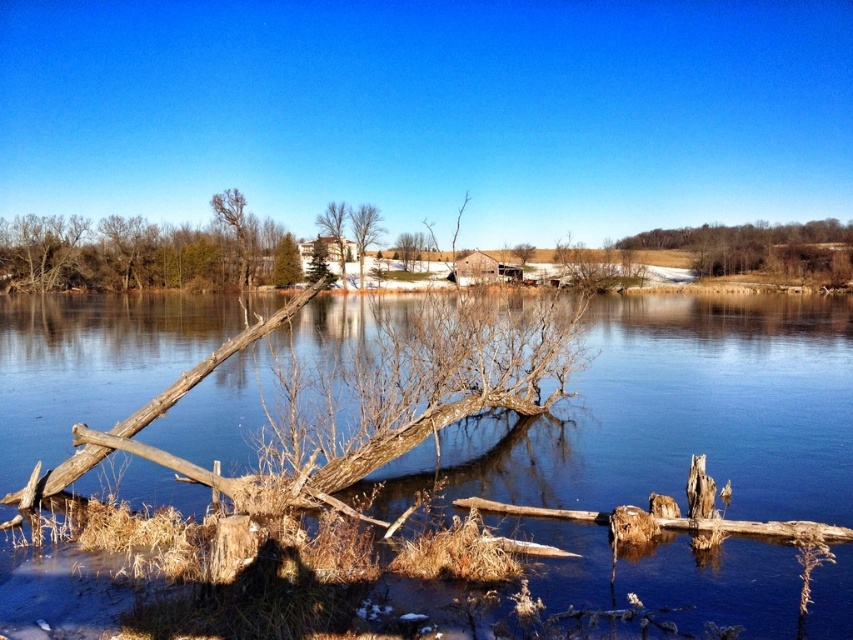
Does point (231, 212) come farther from viewer compared to point (364, 225)?

Yes.

Does bare wood tree at upper left have a greater width compared to bare wood tree at center?

Yes, bare wood tree at upper left is wider than bare wood tree at center.

You are a GUI agent. You are given a task and a screenshot of the screen. Output one action in this format:
    pyautogui.click(x=<x>, y=<y>)
    Task: Click on the bare wood tree at upper left
    The height and width of the screenshot is (640, 853).
    Given the screenshot: What is the action you would take?
    pyautogui.click(x=236, y=228)

Identify the location of bare wood tree at upper left. (236, 228).

Looking at this image, which is more to the right, smooth white house at center or green matte tree at center?

Positioned to the right is smooth white house at center.

Is smooth white house at center above green matte tree at center?

Yes.

Between point (335, 227) and point (321, 248), which one is positioned behind?

Point (335, 227)

Where is `smooth white house at center`? The width and height of the screenshot is (853, 640). smooth white house at center is located at coordinates (335, 230).

Between point (619, 340) and point (242, 211), which one is positioned in front?

Point (619, 340) is more forward.

Image resolution: width=853 pixels, height=640 pixels. I want to click on clear blue water at center, so click(x=683, y=412).